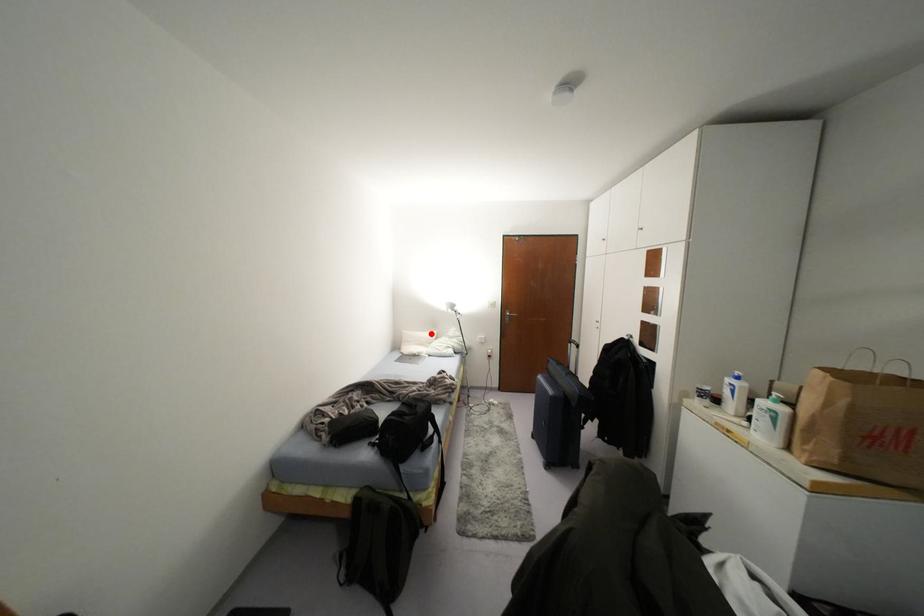
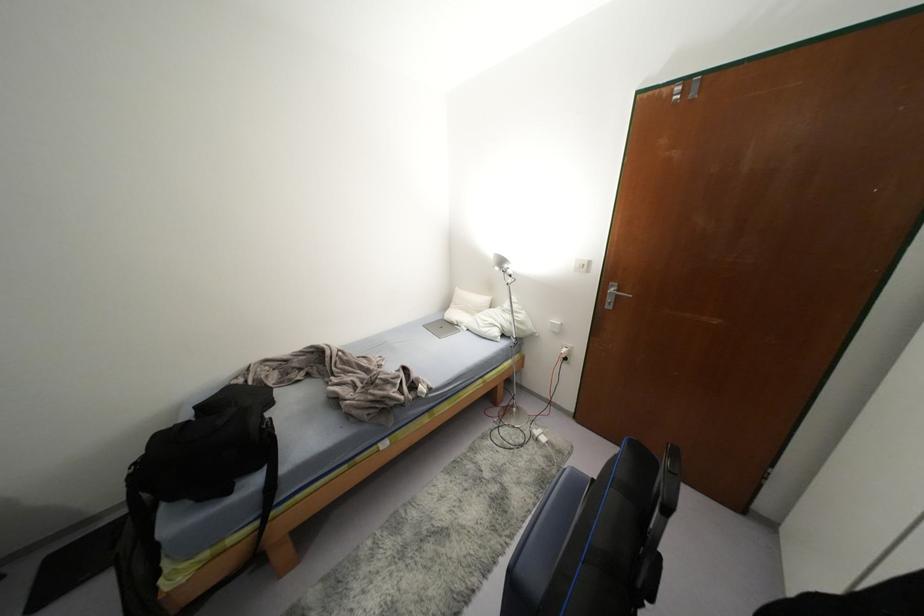
Question: I am providing you with two images of the same scene from different viewpoints. Given a red point in image1, look at the same physical point in image2. Is it:

Choices:
 (A) Closer to the viewpoint
 (B) Farther from the viewpoint

Answer: (A)